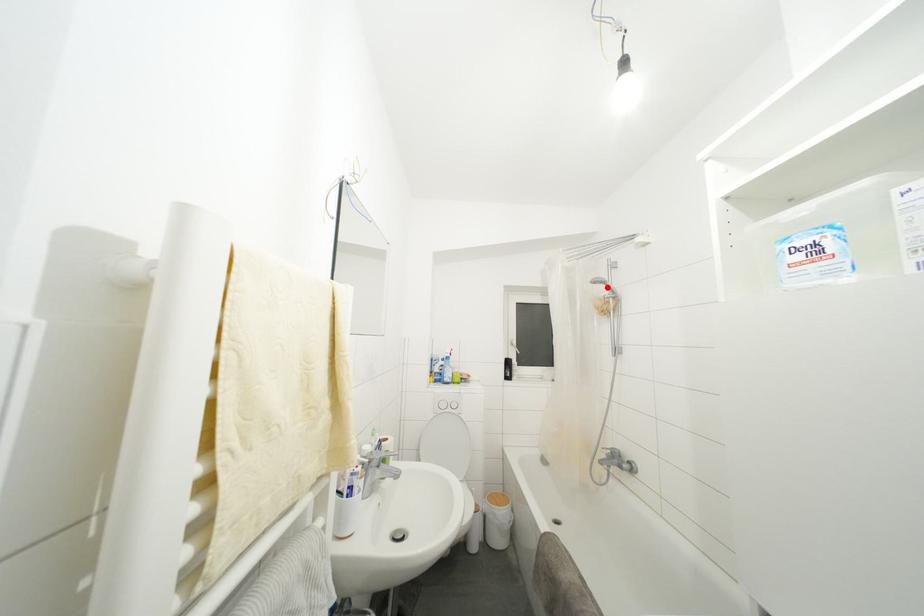
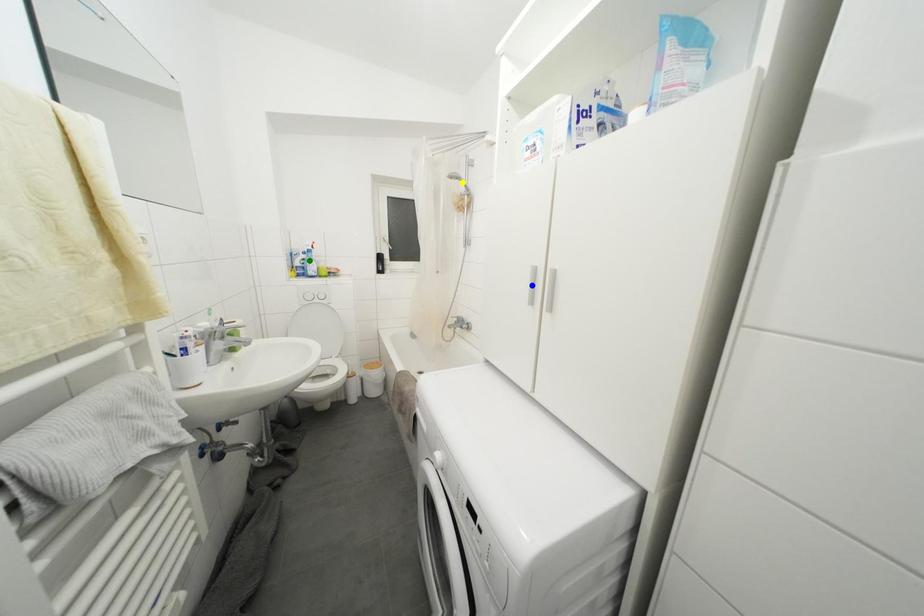
Question: I am providing you with two images of the same scene from different viewpoints. A red point is marked on the first image. You are given multiple points on the second image. Which point in image 2 represents the same 3d spot as the red point in image 1?

Choices:
 (A) yellow point
 (B) blue point
 (C) green point

Answer: (A)